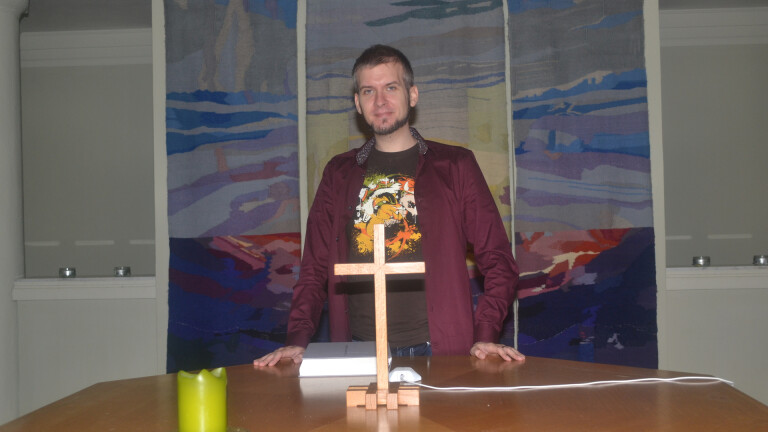
You are a GUI agent. You are given a task and a screenshot of the screen. Output one action in this format:
    pyautogui.click(x=<x>, y=<y>)
    Task: Click on the frame
    The height and width of the screenshot is (432, 768).
    Given the screenshot: What is the action you would take?
    pyautogui.click(x=96, y=288)